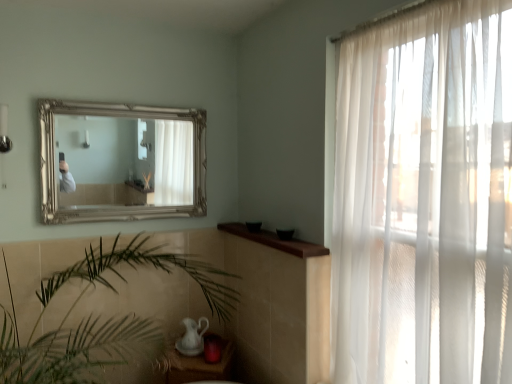
Question: From a real-world perspective, is sheer white curtain at right physically below green leafy plant at center?

Choices:
 (A) no
 (B) yes

Answer: (A)

Question: Is sheer white curtain at right completely or partially outside of green leafy plant at center?

Choices:
 (A) yes
 (B) no

Answer: (A)

Question: Does sheer white curtain at right lie in front of green leafy plant at center?

Choices:
 (A) yes
 (B) no

Answer: (A)

Question: From the image's perspective, is sheer white curtain at right over green leafy plant at center?

Choices:
 (A) no
 (B) yes

Answer: (B)

Question: Is sheer white curtain at right next to green leafy plant at center?

Choices:
 (A) no
 (B) yes

Answer: (A)

Question: Can you confirm if sheer white curtain at right is bigger than green leafy plant at center?

Choices:
 (A) no
 (B) yes

Answer: (A)

Question: Is gold metallic mirror at upper center positioned behind green leafy plant at center?

Choices:
 (A) no
 (B) yes

Answer: (B)

Question: From a real-world perspective, is gold metallic mirror at upper center under green leafy plant at center?

Choices:
 (A) no
 (B) yes

Answer: (A)

Question: Is the position of gold metallic mirror at upper center less distant than that of green leafy plant at center?

Choices:
 (A) no
 (B) yes

Answer: (A)

Question: Are gold metallic mirror at upper center and green leafy plant at center making contact?

Choices:
 (A) yes
 (B) no

Answer: (B)

Question: From the image's perspective, does gold metallic mirror at upper center appear lower than green leafy plant at center?

Choices:
 (A) yes
 (B) no

Answer: (B)

Question: Is gold metallic mirror at upper center looking in the opposite direction of green leafy plant at center?

Choices:
 (A) yes
 (B) no

Answer: (B)

Question: From the image's perspective, is gold metallic mirror at upper center on sheer white curtain at right?

Choices:
 (A) yes
 (B) no

Answer: (A)